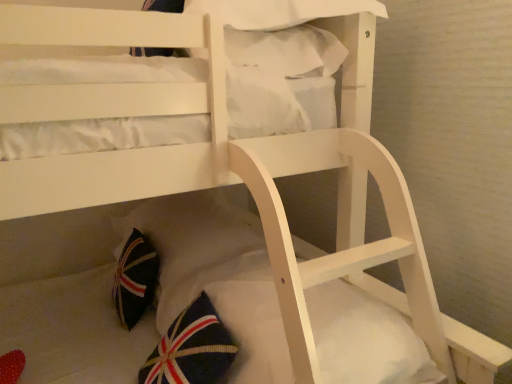
Question: From the image's perspective, would you say white fabric pillow at upper center, the 1th pillow positioned from the top, is shown under white soft mattress at lower center?

Choices:
 (A) yes
 (B) no

Answer: (B)

Question: Is the position of white fabric pillow at upper center, which is counted as the 2th pillow, starting from the bottom, more distant than that of white soft mattress at lower center?

Choices:
 (A) no
 (B) yes

Answer: (B)

Question: From the image's perspective, is white fabric pillow at upper center, which is counted as the 2th pillow, starting from the bottom, located above white soft mattress at lower center?

Choices:
 (A) yes
 (B) no

Answer: (A)

Question: Is white fabric pillow at upper center, which is counted as the 2th pillow, starting from the bottom, turned away from white soft mattress at lower center?

Choices:
 (A) yes
 (B) no

Answer: (B)

Question: Considering the relative sizes of white fabric pillow at upper center, the 1th pillow positioned from the top, and white soft mattress at lower center in the image provided, is white fabric pillow at upper center, the 1th pillow positioned from the top, wider than white soft mattress at lower center?

Choices:
 (A) no
 (B) yes

Answer: (B)

Question: From a real-world perspective, relative to dark blue fabric pillow at lower center, which appears as the second pillow when viewed from the top, is white fabric pillow at upper center, the 1th pillow positioned from the top, vertically above or below?

Choices:
 (A) above
 (B) below

Answer: (A)

Question: In terms of size, does white fabric pillow at upper center, the 1th pillow positioned from the top, appear bigger or smaller than dark blue fabric pillow at lower center, the first pillow ordered from the bottom?

Choices:
 (A) small
 (B) big

Answer: (A)

Question: From the image's perspective, is white fabric pillow at upper center, the 1th pillow positioned from the top, above or below dark blue fabric pillow at lower center, the first pillow ordered from the bottom?

Choices:
 (A) below
 (B) above

Answer: (B)

Question: Is white fabric pillow at upper center, which is counted as the 2th pillow, starting from the bottom, situated inside dark blue fabric pillow at lower center, the first pillow ordered from the bottom, or outside?

Choices:
 (A) inside
 (B) outside

Answer: (B)

Question: Visually, is dark blue fabric pillow at lower center, which appears as the second pillow when viewed from the top, positioned to the left or to the right of white soft mattress at lower center?

Choices:
 (A) left
 (B) right

Answer: (A)

Question: Is dark blue fabric pillow at lower center, which appears as the second pillow when viewed from the top, bigger or smaller than white soft mattress at lower center?

Choices:
 (A) big
 (B) small

Answer: (A)

Question: Is dark blue fabric pillow at lower center, which appears as the second pillow when viewed from the top, taller or shorter than white soft mattress at lower center?

Choices:
 (A) tall
 (B) short

Answer: (A)

Question: From the image's perspective, is dark blue fabric pillow at lower center, the first pillow ordered from the bottom, positioned above or below white soft mattress at lower center?

Choices:
 (A) above
 (B) below

Answer: (A)

Question: Visually, is white soft mattress at lower center positioned to the left or to the right of dark blue fabric pillow at lower center, the first pillow ordered from the bottom?

Choices:
 (A) left
 (B) right

Answer: (B)

Question: Looking at their shapes, would you say white soft mattress at lower center is wider or thinner than dark blue fabric pillow at lower center, the first pillow ordered from the bottom?

Choices:
 (A) thin
 (B) wide

Answer: (A)